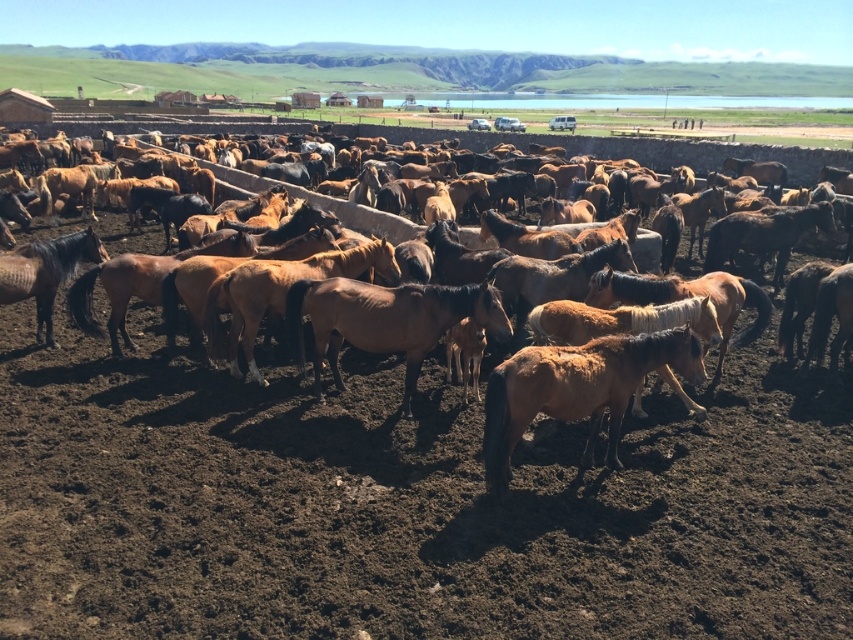
You are a farmer who wants to fit both the brown textured horse at center and the brown matte horse at center into a 3 meter wide stall. Given their widths, can both horses fit side by side in the stall?

The brown textured horse at center is narrower than the brown matte horse at center. However, without knowing the exact widths of both horses, it is impossible to determine if their combined width is less than 3 meters. More information is needed to answer this question accurately.

You are a horse trainer observing the horses in the corral. You notice two brown horses at the center of the scene. Which one is closer to you, the brown textured horse at center or the brown matte horse at center?

The brown textured horse at center is closer to you because it is positioned further to the viewer than the brown matte horse at center.